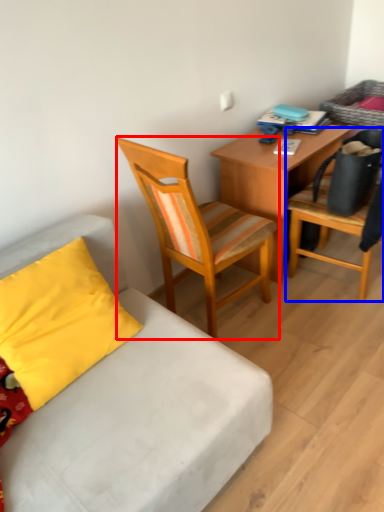
Question: Which object appears closest to the camera in this image, chair (highlighted by a red box) or chair (highlighted by a blue box)?

Choices:
 (A) chair
 (B) chair

Answer: (A)